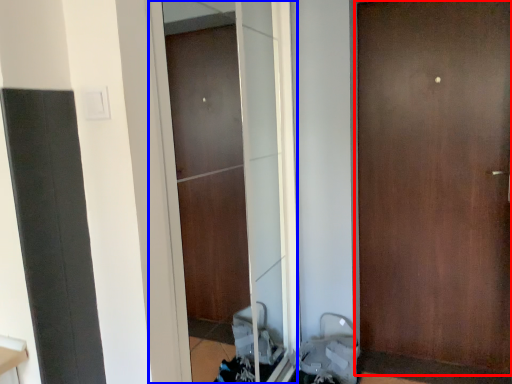
Question: Which of the following is the farthest to the observer, door (highlighted by a red box) or screen door (highlighted by a blue box)?

Choices:
 (A) door
 (B) screen door

Answer: (A)